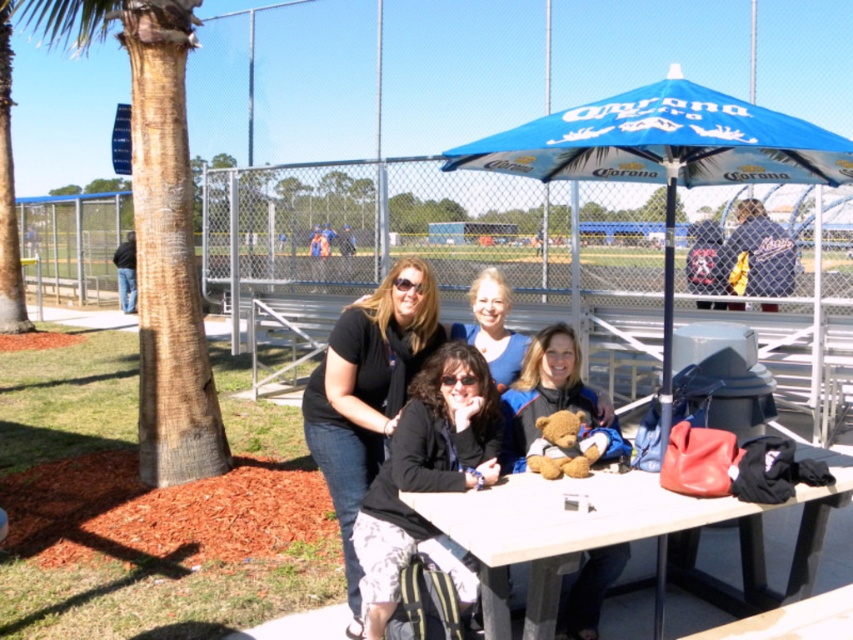
Which is more to the right, blue fabric umbrella at upper center or brown plush bear at center?

blue fabric umbrella at upper center

Between blue fabric umbrella at upper center and brown plush bear at center, which one appears on the left side from the viewer's perspective?

brown plush bear at center is more to the left.

Between point (529, 132) and point (590, 566), which one is positioned behind?

Positioned behind is point (590, 566).

Image resolution: width=853 pixels, height=640 pixels. I want to click on blue fabric umbrella at upper center, so click(x=664, y=154).

Who is positioned more to the right, brown textured palm tree at left or brown plush bear at center?

brown plush bear at center

Is brown textured palm tree at left taller than brown plush bear at center?

Correct, brown textured palm tree at left is much taller as brown plush bear at center.

You are a GUI agent. You are given a task and a screenshot of the screen. Output one action in this format:
    pyautogui.click(x=<x>, y=<y>)
    Task: Click on the brown textured palm tree at left
    This screenshot has height=640, width=853.
    Given the screenshot: What is the action you would take?
    pyautogui.click(x=155, y=227)

Does point (477, 417) lie behind point (515, 422)?

That is False.

Is black matte jacket at center thinner than brown plush bear at center?

No.

Who is more distant from viewer, (405,529) or (549,326)?

Point (549,326)

Find the location of a particular element. This screenshot has width=853, height=640. black matte jacket at center is located at coordinates (425, 468).